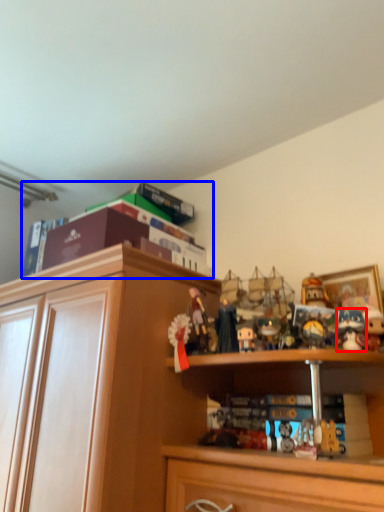
Question: Which object is further to the camera taking this photo, toy (highlighted by a red box) or book (highlighted by a blue box)?

Choices:
 (A) toy
 (B) book

Answer: (B)